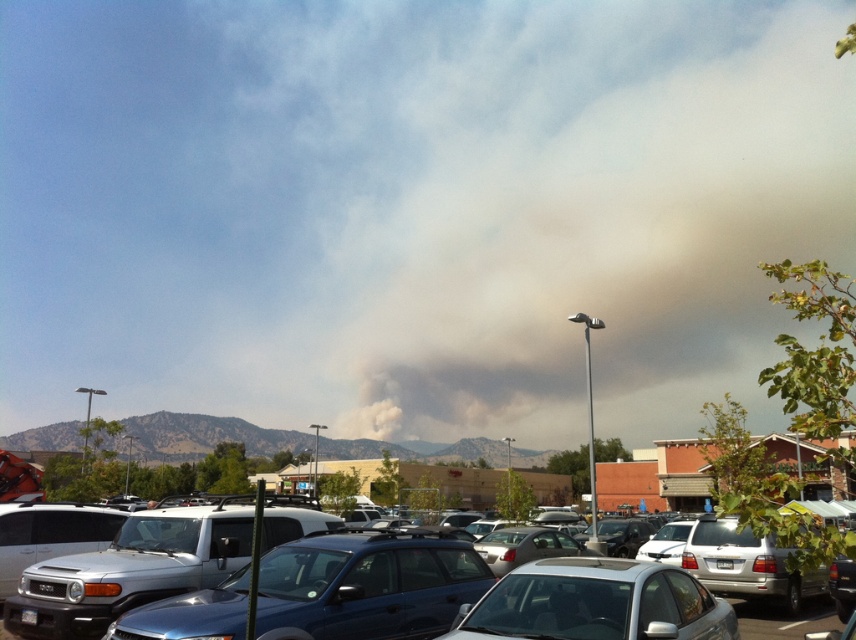
You are standing in the parking lot and want to get to the metallic silver car at center. There is a smokey gray sedan at center blocking your path. Can you walk around it easily?

The smokey gray sedan at center is closer to the viewer than the metallic silver car at center, so you can walk around it easily since it is in front and not directly blocking the path.

You are a parking attendant who needs to fit a compact car into the parking spot reserved for compact vehicles. The metallic blue suv at center and the metallic silver car at center are currently occupying adjacent spots. Which vehicle should you ask to move so that the compact car can park in the appropriate spot?

The metallic blue suv at center has a smaller size compared to the metallic silver car at center. Since the compact car needs a smaller space, the metallic silver car at center, being larger, should move to allow the compact car to park in the metallic blue suv at center spot.